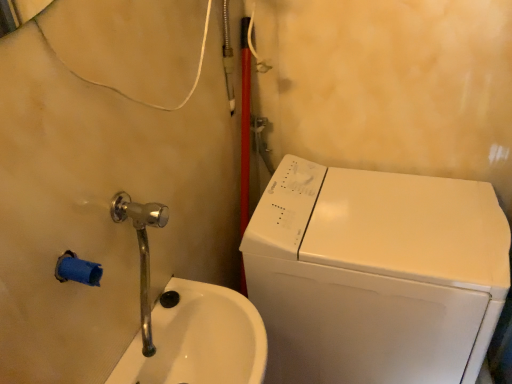
What is the approximate height of white glossy washing machine at right?

It is 35.07 inches.

Identify the location of white glossy washing machine at right. (375, 275).

Does white glossy washing machine at right appear on the left side of white glossy sink at lower left?

Incorrect, white glossy washing machine at right is not on the left side of white glossy sink at lower left.

Is white glossy washing machine at right further to the viewer compared to white glossy sink at lower left?

Yes, the depth of white glossy washing machine at right is greater than that of white glossy sink at lower left.

Is white glossy washing machine at right wider or thinner than white glossy sink at lower left?

Clearly, white glossy washing machine at right has more width compared to white glossy sink at lower left.

In order to click on sink that is above the white glossy washing machine at right (from a real-world perspective) in this screenshot , I will do `click(199, 340)`.

Looking at this image, in terms of height, does polished chrome faucet at lower left look taller or shorter compared to white glossy sink at lower left?

Considering their sizes, polished chrome faucet at lower left has more height than white glossy sink at lower left.

Would you say polished chrome faucet at lower left is inside or outside white glossy sink at lower left?

polished chrome faucet at lower left cannot be found inside white glossy sink at lower left.

I want to click on plumbing fixture positioned vertically above the white glossy sink at lower left (from a real-world perspective), so click(x=141, y=251).

Does polished chrome faucet at lower left appear on the left side of white glossy sink at lower left?

Yes.

Considering the relative sizes of white glossy sink at lower left and white glossy washing machine at right in the image provided, is white glossy sink at lower left wider than white glossy washing machine at right?

In fact, white glossy sink at lower left might be narrower than white glossy washing machine at right.

Which is more to the left, white glossy sink at lower left or white glossy washing machine at right?

white glossy sink at lower left.

Is point (241, 326) in front of point (289, 200)?

Yes, point (241, 326) is closer to viewer.

Find the location of a particular element. washing machine that is behind the white glossy sink at lower left is located at coordinates (375, 275).

In the scene shown: Considering the sizes of objects polished chrome faucet at lower left and white glossy washing machine at right in the image provided, who is wider, polished chrome faucet at lower left or white glossy washing machine at right?

Wider between the two is white glossy washing machine at right.

Locate an element on the screen. washing machine below the polished chrome faucet at lower left (from the image's perspective) is located at coordinates (375, 275).

Would you say polished chrome faucet at lower left is inside or outside white glossy washing machine at right?

polished chrome faucet at lower left exists outside the volume of white glossy washing machine at right.

Between white glossy washing machine at right and polished chrome faucet at lower left, which one has larger size?

Bigger between the two is white glossy washing machine at right.

Is white glossy washing machine at right to the right of polished chrome faucet at lower left from the viewer's perspective?

Correct, you'll find white glossy washing machine at right to the right of polished chrome faucet at lower left.

Which is behind, white glossy washing machine at right or polished chrome faucet at lower left?

white glossy washing machine at right is behind.

Is white glossy sink at lower left positioned far away from polished chrome faucet at lower left?

No, there isn't a large distance between white glossy sink at lower left and polished chrome faucet at lower left.

Which is less distant, (172, 363) or (141, 218)?

Point (172, 363) appears to be farther away from the viewer than point (141, 218).

Find the location of a particular element. sink on the right of polished chrome faucet at lower left is located at coordinates (199, 340).

From a real-world perspective, is white glossy sink at lower left physically located above or below polished chrome faucet at lower left?

white glossy sink at lower left is situated lower than polished chrome faucet at lower left in the real world.

Identify the location of sink lying above the white glossy washing machine at right (from the image's perspective). This screenshot has width=512, height=384. (199, 340).

This screenshot has width=512, height=384. Find the location of `plumbing fixture that appears on the left of white glossy sink at lower left`. plumbing fixture that appears on the left of white glossy sink at lower left is located at coordinates (141, 251).

Based on the photo, when comparing their distances from white glossy sink at lower left, does polished chrome faucet at lower left or white glossy washing machine at right seem closer?

polished chrome faucet at lower left.

Considering their positions, is white glossy washing machine at right positioned closer to white glossy sink at lower left than polished chrome faucet at lower left?

polished chrome faucet at lower left.

Considering their positions, is white glossy sink at lower left positioned further to polished chrome faucet at lower left than white glossy washing machine at right?

white glossy washing machine at right is further to polished chrome faucet at lower left.

From the image, which object appears to be farther from white glossy washing machine at right, polished chrome faucet at lower left or white glossy sink at lower left?

The object further to white glossy washing machine at right is polished chrome faucet at lower left.

Which object lies nearer to the anchor point white glossy washing machine at right, white glossy sink at lower left or polished chrome faucet at lower left?

Based on the image, white glossy sink at lower left appears to be nearer to white glossy washing machine at right.

Based on their spatial positions, is white glossy washing machine at right or white glossy sink at lower left further from polished chrome faucet at lower left?

Based on the image, white glossy washing machine at right appears to be further to polished chrome faucet at lower left.

I want to click on sink situated between polished chrome faucet at lower left and white glossy washing machine at right from left to right, so click(199, 340).